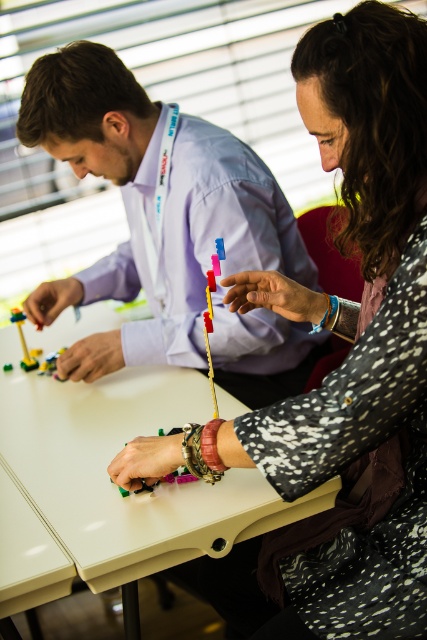
Between matte purple shirt at upper center and leather-like brown bracelet at lower center, which one is positioned lower?

Positioned lower is leather-like brown bracelet at lower center.

Measure the distance between matte purple shirt at upper center and camera.

They are 1.52 meters apart.

Between point (137, 358) and point (202, 436), which one is positioned behind?

The point (137, 358) is more distant.

Locate an element on the screen. matte purple shirt at upper center is located at coordinates (151, 205).

Does matte purple shirt at upper center appear over blue fabric bracelet at lower center?

Yes, matte purple shirt at upper center is above blue fabric bracelet at lower center.

Can you confirm if matte purple shirt at upper center is smaller than blue fabric bracelet at lower center?

No, matte purple shirt at upper center is not smaller than blue fabric bracelet at lower center.

Which is in front, point (61, 58) or point (336, 300)?

Point (336, 300) is more forward.

Where is `matte purple shirt at upper center`? The width and height of the screenshot is (427, 640). matte purple shirt at upper center is located at coordinates (151, 205).

Does speckled fabric sweater at center have a smaller size compared to leather-like brown bracelet at lower center?

Incorrect, speckled fabric sweater at center is not smaller in size than leather-like brown bracelet at lower center.

Does speckled fabric sweater at center appear over leather-like brown bracelet at lower center?

Correct, speckled fabric sweater at center is located above leather-like brown bracelet at lower center.

Is point (382, 198) positioned behind point (218, 420)?

No.

I want to click on speckled fabric sweater at center, so click(x=351, y=358).